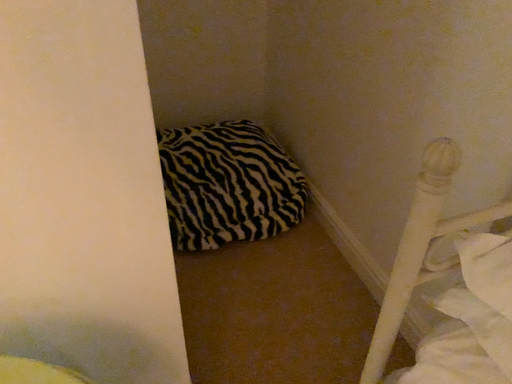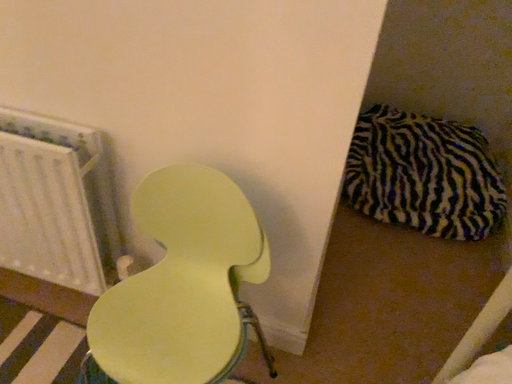
Question: How did the camera likely rotate when shooting the video?

Choices:
 (A) rotated right
 (B) rotated left

Answer: (B)